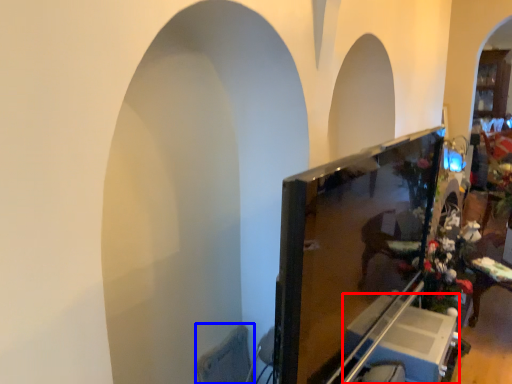
Question: Which object is closer to the camera taking this photo, furniture (highlighted by a red box) or swivel chair (highlighted by a blue box)?

Choices:
 (A) furniture
 (B) swivel chair

Answer: (B)